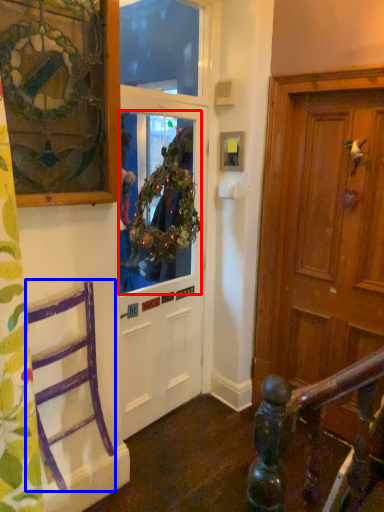
Question: Which of the following is the closest to the observer, window screen (highlighted by a red box) or chair (highlighted by a blue box)?

Choices:
 (A) window screen
 (B) chair

Answer: (B)